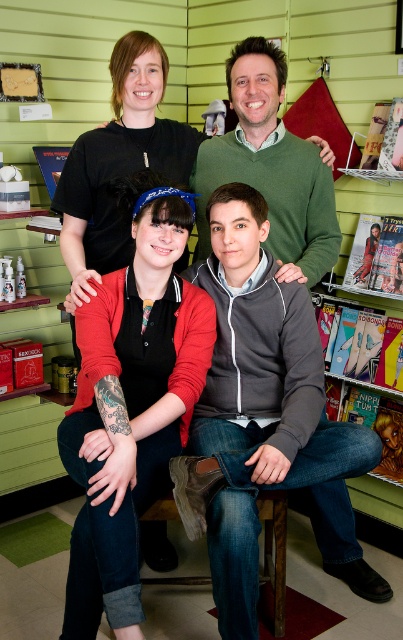
Question: Is red matte cardigan at center thinner than green wool sweater at upper center?

Choices:
 (A) yes
 (B) no

Answer: (A)

Question: In this image, where is gray zip-up hoodie at center located relative to red matte cardigan at center?

Choices:
 (A) below
 (B) above

Answer: (B)

Question: Does gray zip-up hoodie at center appear under green wool sweater at upper center?

Choices:
 (A) no
 (B) yes

Answer: (B)

Question: Which object is farther from the camera taking this photo?

Choices:
 (A) red matte cardigan at center
 (B) green wool sweater at upper center
 (C) gray zip-up hoodie at center

Answer: (B)

Question: Among these points, which one is nearest to the camera?

Choices:
 (A) (326, 236)
 (B) (114, 397)
 (C) (386, 598)

Answer: (B)

Question: Which of the following is the farthest from the observer?

Choices:
 (A) (78, 323)
 (B) (265, 308)

Answer: (B)